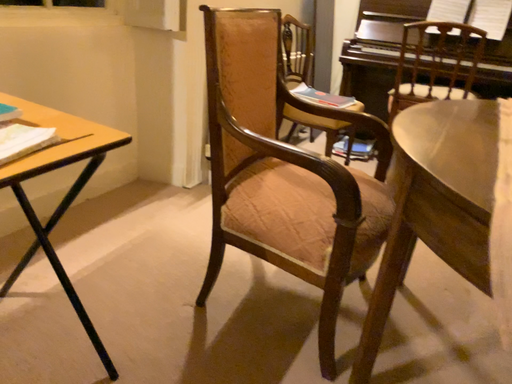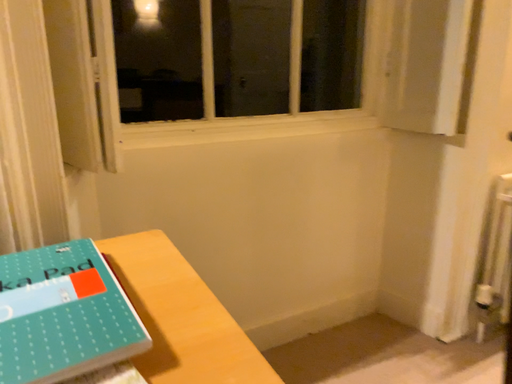
Question: Which way did the camera rotate in the video?

Choices:
 (A) rotated left
 (B) rotated right

Answer: (A)